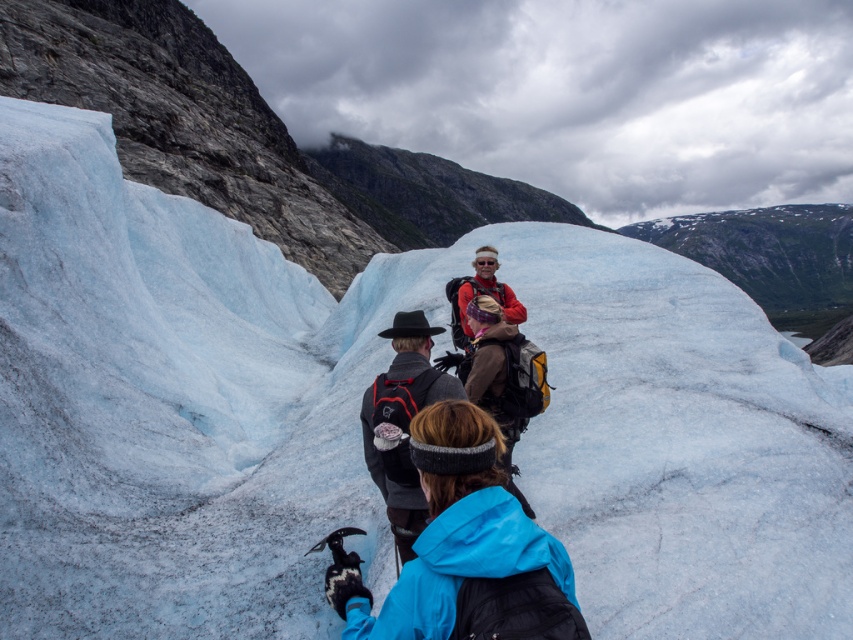
Question: Which object is the farthest from the dark gray wool hat at center?

Choices:
 (A) blue synthetic jacket at center
 (B) matte red jacket at center

Answer: (B)

Question: Can you confirm if blue synthetic jacket at center is positioned below dark gray wool hat at center?

Choices:
 (A) no
 (B) yes

Answer: (B)

Question: Does blue synthetic jacket at center appear on the left side of dark gray wool hat at center?

Choices:
 (A) yes
 (B) no

Answer: (B)

Question: Which point is farther from the camera taking this photo?

Choices:
 (A) (419, 541)
 (B) (368, 436)

Answer: (B)

Question: Which point is closer to the camera taking this photo?

Choices:
 (A) (434, 627)
 (B) (485, 285)
 (C) (383, 385)

Answer: (A)

Question: Is blue synthetic jacket at center to the left of matte red jacket at center from the viewer's perspective?

Choices:
 (A) yes
 (B) no

Answer: (A)